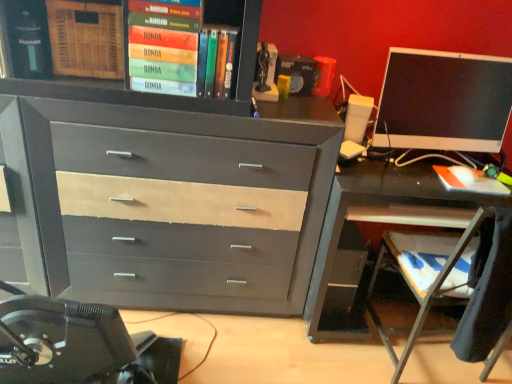
Find the location of a particular element. This screenshot has height=384, width=512. vacant area situated to the left side of orange matte book at right, placed as the first book when sorted from bottom to top is located at coordinates (418, 172).